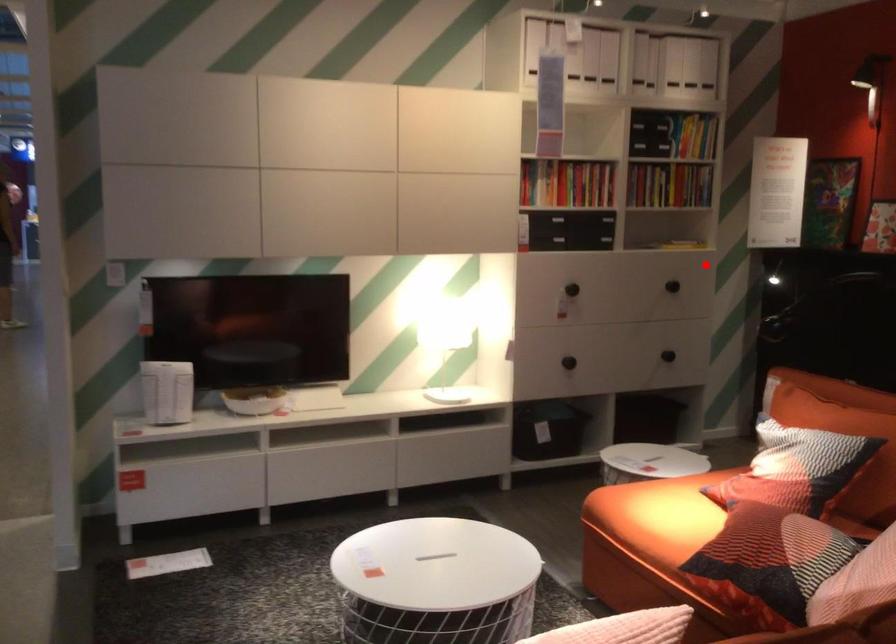
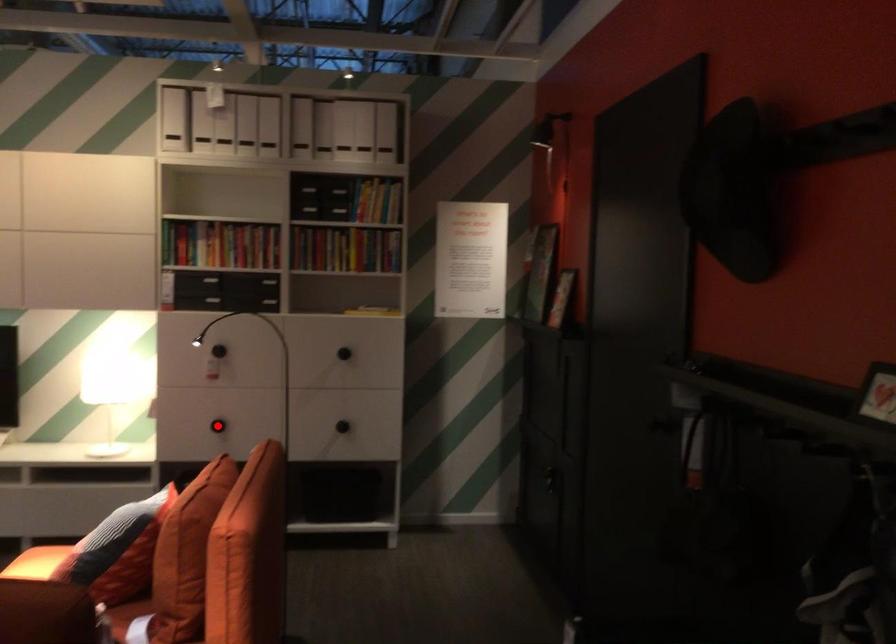
I am providing you with two images of the same scene from different viewpoints. A red point is marked on the first image and another point is marked on the second image. Is the red point in image1 aligned with the point shown in image2?

No